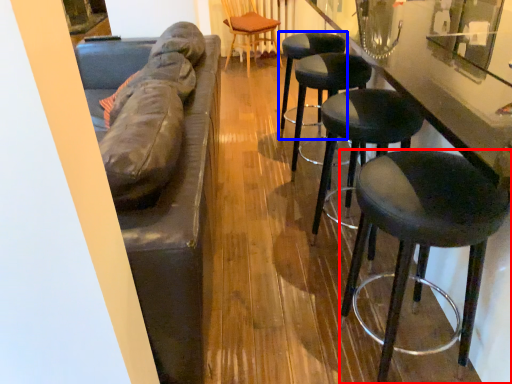
Question: Among these objects, which one is farthest to the camera, stool (highlighted by a red box) or stool (highlighted by a blue box)?

Choices:
 (A) stool
 (B) stool

Answer: (B)